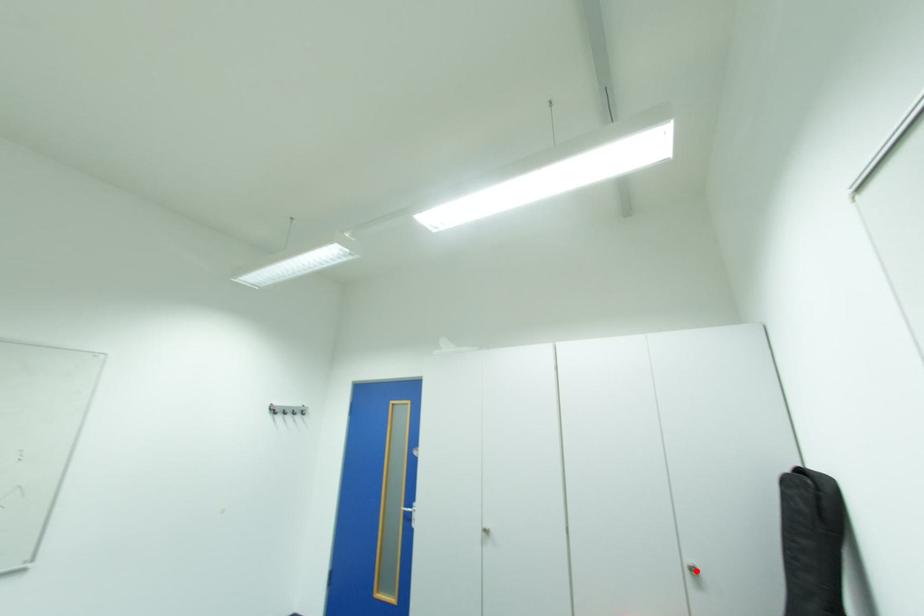
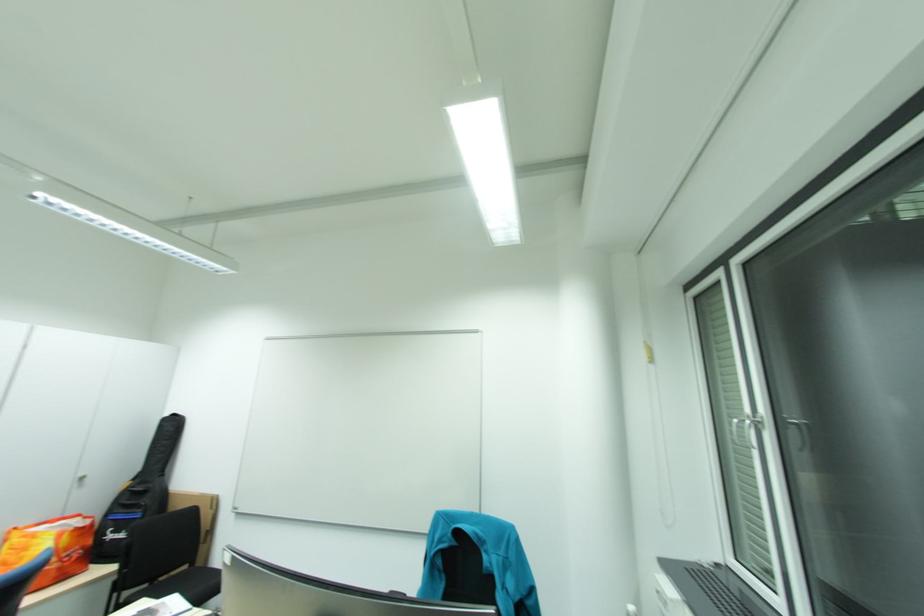
Question: I am providing you with two images of the same scene from different viewpoints. Given a red point in image1, look at the same physical point in image2. Is it:

Choices:
 (A) Closer to the viewpoint
 (B) Farther from the viewpoint

Answer: (A)